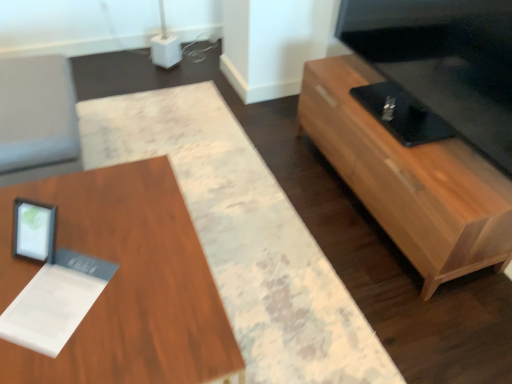
Describe the element at coordinates (124, 282) in the screenshot. I see `wooden table at center, which appears as the second table when viewed from the right` at that location.

What is the approximate height of wooden table at center, which is the 1th table in left-to-right order?

wooden table at center, which is the 1th table in left-to-right order, is 16.32 inches tall.

Image resolution: width=512 pixels, height=384 pixels. Find the location of `wooden table at center, which is the 1th table in left-to-right order`. wooden table at center, which is the 1th table in left-to-right order is located at coordinates (124, 282).

Where is `wooden tv stand at right, which is the 2th table from left to right`? wooden tv stand at right, which is the 2th table from left to right is located at coordinates (409, 179).

This screenshot has width=512, height=384. What do you see at coordinates (409, 179) in the screenshot? I see `wooden tv stand at right, which ranks as the first table in right-to-left order` at bounding box center [409, 179].

This screenshot has height=384, width=512. Find the location of `wooden table at center, which is the 1th table in left-to-right order`. wooden table at center, which is the 1th table in left-to-right order is located at coordinates (124, 282).

Does wooden table at center, which appears as the second table when viewed from the right, appear on the right side of wooden tv stand at right, which is the 2th table from left to right?

No.

Based on the photo, is wooden table at center, which is the 1th table in left-to-right order, positioned behind wooden tv stand at right, which is the 2th table from left to right?

That is False.

Does point (163, 233) lie behind point (328, 133)?

No, it is in front of (328, 133).

From the image's perspective, is wooden table at center, which is the 1th table in left-to-right order, on wooden tv stand at right, which ranks as the first table in right-to-left order?

Incorrect, from the image's perspective, wooden table at center, which is the 1th table in left-to-right order, is lower than wooden tv stand at right, which ranks as the first table in right-to-left order.

From a real-world perspective, is wooden table at center, which is the 1th table in left-to-right order, over wooden tv stand at right, which is the 2th table from left to right?

No, from a real-world perspective, wooden table at center, which is the 1th table in left-to-right order, is not on top of wooden tv stand at right, which is the 2th table from left to right.

Which of these two, wooden table at center, which is the 1th table in left-to-right order, or wooden tv stand at right, which is the 2th table from left to right, is wider?

wooden table at center, which is the 1th table in left-to-right order.

Which of these two, wooden table at center, which appears as the second table when viewed from the right, or wooden tv stand at right, which is the 2th table from left to right, stands taller?

Standing taller between the two is wooden tv stand at right, which is the 2th table from left to right.

Does wooden table at center, which is the 1th table in left-to-right order, have a larger size compared to wooden tv stand at right, which ranks as the first table in right-to-left order?

Correct, wooden table at center, which is the 1th table in left-to-right order, is larger in size than wooden tv stand at right, which ranks as the first table in right-to-left order.

Is wooden tv stand at right, which is the 2th table from left to right, located within wooden table at center, which appears as the second table when viewed from the right?

No.

Is wooden table at center, which is the 1th table in left-to-right order, in contact with wooden tv stand at right, which is the 2th table from left to right?

No, wooden table at center, which is the 1th table in left-to-right order, is not with wooden tv stand at right, which is the 2th table from left to right.

Is wooden table at center, which is the 1th table in left-to-right order, turned away from wooden tv stand at right, which ranks as the first table in right-to-left order?

No, wooden table at center, which is the 1th table in left-to-right order, is not facing the opposite direction of wooden tv stand at right, which ranks as the first table in right-to-left order.

The image size is (512, 384). In order to click on table on the right of wooden table at center, which appears as the second table when viewed from the right in this screenshot , I will do `click(409, 179)`.

Considering the positions of objects wooden tv stand at right, which is the 2th table from left to right, and wooden table at center, which is the 1th table in left-to-right order, in the image provided, who is more to the right, wooden tv stand at right, which is the 2th table from left to right, or wooden table at center, which is the 1th table in left-to-right order,?

wooden tv stand at right, which is the 2th table from left to right, is more to the right.

In the scene shown: Which object is more forward, wooden tv stand at right, which is the 2th table from left to right, or wooden table at center, which is the 1th table in left-to-right order?

wooden table at center, which is the 1th table in left-to-right order, is in front.

Does point (466, 149) appear closer or farther from the camera than point (143, 270)?

Clearly, point (466, 149) is more distant from the camera than point (143, 270).

From the image's perspective, is wooden tv stand at right, which ranks as the first table in right-to-left order, above or below wooden table at center, which is the 1th table in left-to-right order?

wooden tv stand at right, which ranks as the first table in right-to-left order, is above wooden table at center, which is the 1th table in left-to-right order.

From a real-world perspective, is wooden tv stand at right, which ranks as the first table in right-to-left order, physically below wooden table at center, which appears as the second table when viewed from the right?

No, from a real-world perspective, wooden tv stand at right, which ranks as the first table in right-to-left order, is not beneath wooden table at center, which appears as the second table when viewed from the right.

Which object is thinner, wooden tv stand at right, which ranks as the first table in right-to-left order, or wooden table at center, which appears as the second table when viewed from the right?

Thinner between the two is wooden tv stand at right, which ranks as the first table in right-to-left order.

From their relative heights in the image, would you say wooden tv stand at right, which ranks as the first table in right-to-left order, is taller or shorter than wooden table at center, which is the 1th table in left-to-right order?

wooden tv stand at right, which ranks as the first table in right-to-left order, is taller than wooden table at center, which is the 1th table in left-to-right order.

Is wooden tv stand at right, which ranks as the first table in right-to-left order, bigger or smaller than wooden table at center, which is the 1th table in left-to-right order?

wooden tv stand at right, which ranks as the first table in right-to-left order, is smaller than wooden table at center, which is the 1th table in left-to-right order.

Is wooden tv stand at right, which ranks as the first table in right-to-left order, inside the boundaries of wooden table at center, which appears as the second table when viewed from the right, or outside?

wooden tv stand at right, which ranks as the first table in right-to-left order, is located beyond the bounds of wooden table at center, which appears as the second table when viewed from the right.

Is wooden tv stand at right, which ranks as the first table in right-to-left order, placed right next to wooden table at center, which is the 1th table in left-to-right order?

No, wooden tv stand at right, which ranks as the first table in right-to-left order, is not in contact with wooden table at center, which is the 1th table in left-to-right order.

Is wooden tv stand at right, which is the 2th table from left to right, facing towards wooden table at center, which is the 1th table in left-to-right order?

Yes.

The width and height of the screenshot is (512, 384). Find the location of `table in front of the wooden tv stand at right, which is the 2th table from left to right`. table in front of the wooden tv stand at right, which is the 2th table from left to right is located at coordinates (124, 282).

Where is `table above the wooden table at center, which is the 1th table in left-to-right order (from the image's perspective)`? table above the wooden table at center, which is the 1th table in left-to-right order (from the image's perspective) is located at coordinates pyautogui.click(x=409, y=179).

Find the location of `table below the wooden tv stand at right, which is the 2th table from left to right (from a real-world perspective)`. table below the wooden tv stand at right, which is the 2th table from left to right (from a real-world perspective) is located at coordinates (124, 282).